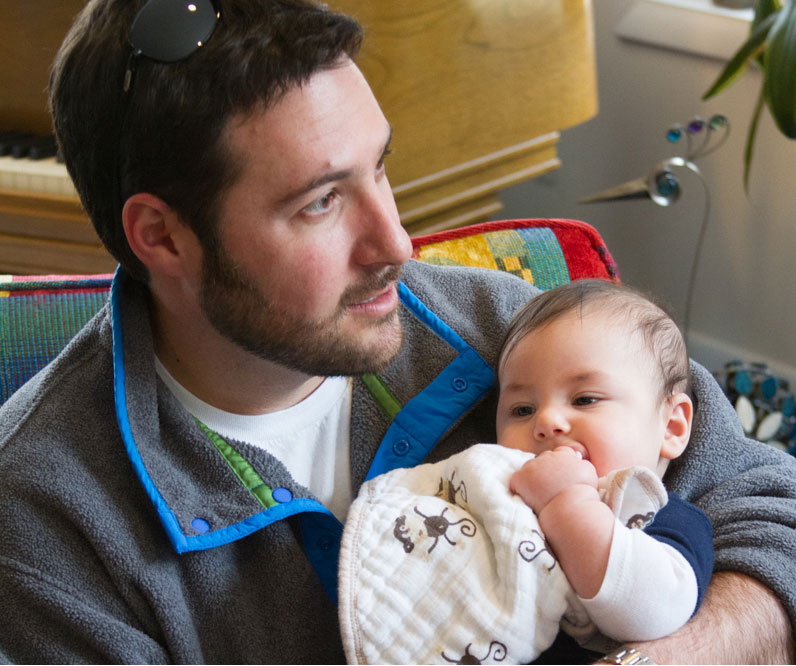
At what (x,y) coordinates should I click in order to perform the action: click on white wall. Please return your answer as a coordinate pair (x, y). The width and height of the screenshot is (796, 666). Looking at the image, I should click on (790, 165).